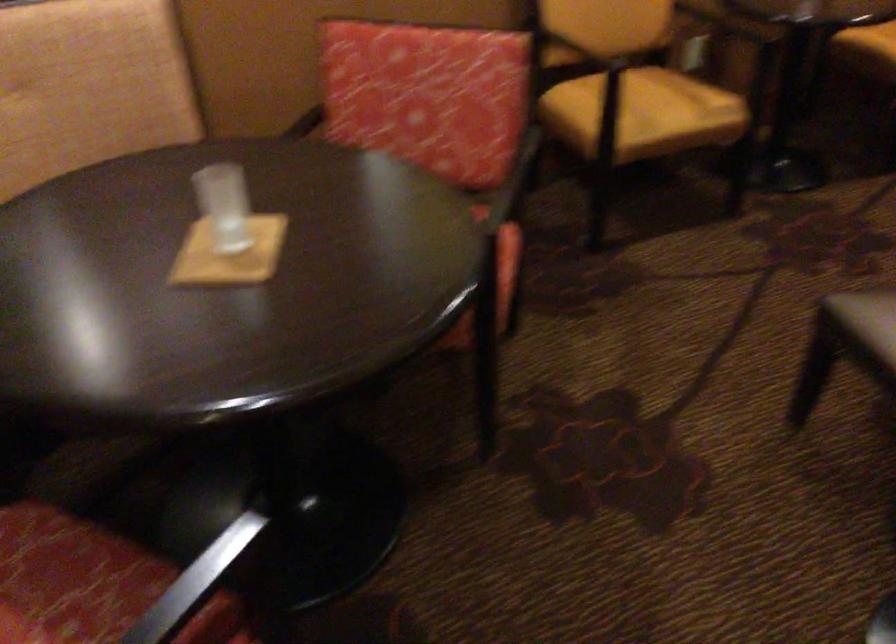
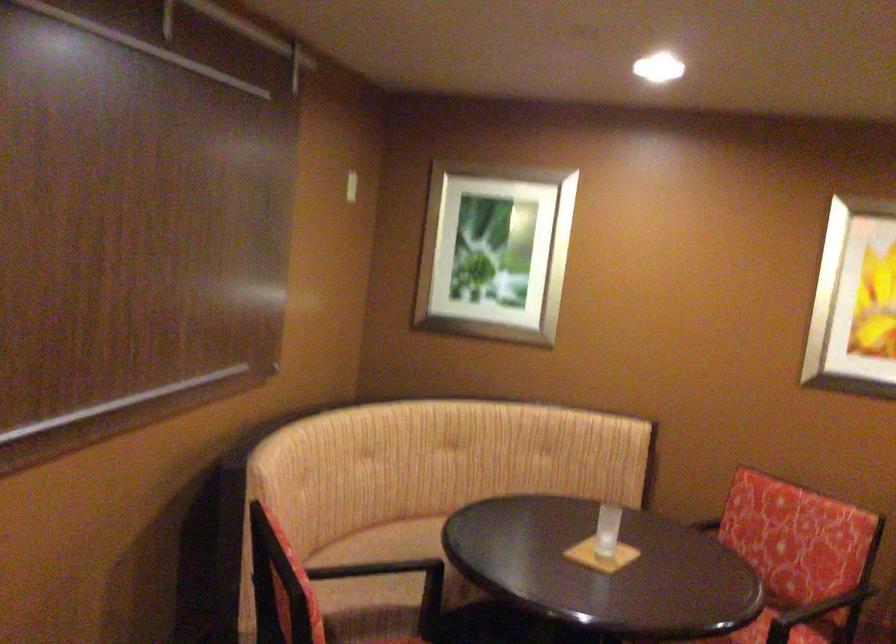
The point at (228, 182) is marked in the first image. Where is the corresponding point in the second image?

(607, 529)